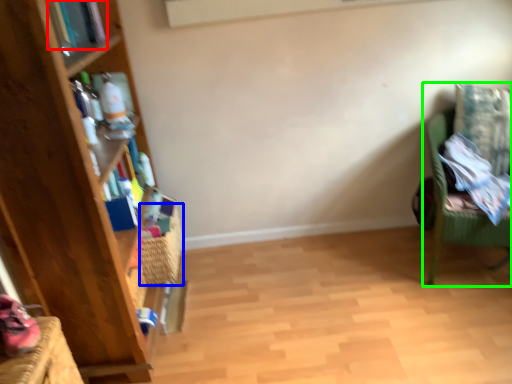
Question: Based on their relative distances, which object is nearer to book (highlighted by a red box)? Choose from basket (highlighted by a blue box) and chair (highlighted by a green box).

Choices:
 (A) basket
 (B) chair

Answer: (A)